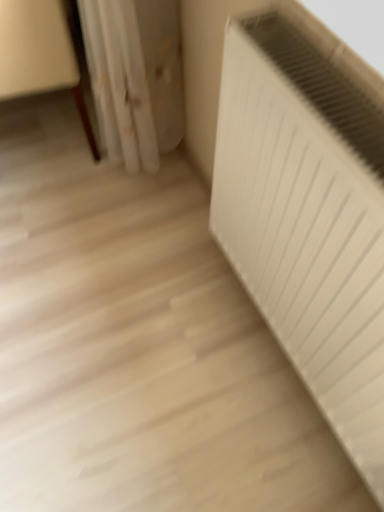
You are a GUI agent. You are given a task and a screenshot of the screen. Output one action in this format:
    pyautogui.click(x=<x>, y=<y>)
    Task: Click on the vacant area that is in front of wooden floor at lower left
    Image resolution: width=384 pixels, height=512 pixels.
    Given the screenshot: What is the action you would take?
    pyautogui.click(x=62, y=228)